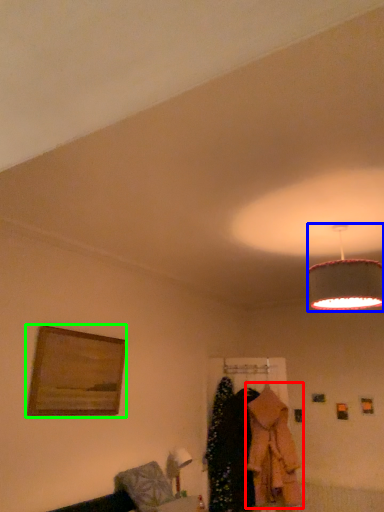
Question: Which object is positioned closest to clothing (highlighted by a red box)? Select from lamp (highlighted by a blue box) and picture frame (highlighted by a green box).

Choices:
 (A) lamp
 (B) picture frame

Answer: (B)